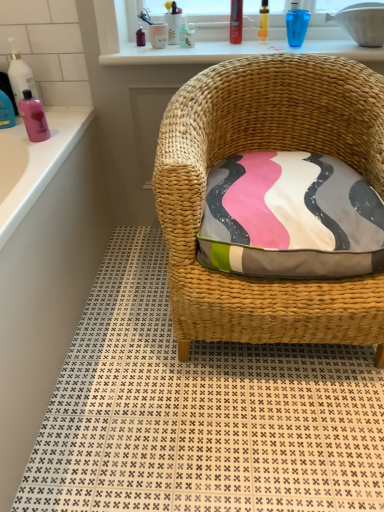
In order to click on woven wicker chair at center in this screenshot , I will do `click(200, 412)`.

The image size is (384, 512). What do you see at coordinates (296, 24) in the screenshot?
I see `translucent plastic cup at upper right, arranged as the first toiletry when viewed from the right` at bounding box center [296, 24].

From the picture: What is the approximate width of translucent yellow bottle at upper center, the second toiletry viewed from the left?

The width of translucent yellow bottle at upper center, the second toiletry viewed from the left, is 1.26 inches.

The image size is (384, 512). What do you see at coordinates (20, 75) in the screenshot? I see `translucent plastic bottle at left, which is the 1th cleaning product from left to right` at bounding box center [20, 75].

What is the approximate height of woven wicker chair at center?

The height of woven wicker chair at center is 31.91 inches.

In order to face shiny plastic tube at upper center, placed as the 3th toiletry when sorted from right to left, should I rotate leftwards or rightwards?

Turn right approximately 5.756 degrees to face it.

You are a GUI agent. You are given a task and a screenshot of the screen. Output one action in this format:
    pyautogui.click(x=<x>, y=<y>)
    Task: Click on the pink glossy bottle at left, the first cleaning product in the right-to-left sequence
    This screenshot has height=512, width=384.
    Given the screenshot: What is the action you would take?
    pyautogui.click(x=33, y=117)

What do you see at coordinates (33, 117) in the screenshot? I see `pink glossy bottle at left, positioned as the second cleaning product in back-to-front order` at bounding box center [33, 117].

The image size is (384, 512). In order to click on woven wicker chair at center in this screenshot , I will do `click(200, 412)`.

Is shiny plastic tube at upper center, the first toiletry viewed from the left, taller than textured fabric pillow at center?

Yes, shiny plastic tube at upper center, the first toiletry viewed from the left, is taller than textured fabric pillow at center.

From the image's perspective, is shiny plastic tube at upper center, the first toiletry viewed from the left, over textured fabric pillow at center?

Indeed, from the image's perspective, shiny plastic tube at upper center, the first toiletry viewed from the left, is shown above textured fabric pillow at center.

Is shiny plastic tube at upper center, placed as the 3th toiletry when sorted from right to left, not inside textured fabric pillow at center?

shiny plastic tube at upper center, placed as the 3th toiletry when sorted from right to left, lies outside textured fabric pillow at center's area.

Is shiny plastic tube at upper center, placed as the 3th toiletry when sorted from right to left, with textured fabric pillow at center?

No, shiny plastic tube at upper center, placed as the 3th toiletry when sorted from right to left, is not touching textured fabric pillow at center.

At what (x,y) coordinates should I click in order to perform the action: click on the 1st toiletry counting from the left side of the textured fabric pillow at center. Please return your answer as a coordinate pair (x, y). Image resolution: width=384 pixels, height=512 pixels. Looking at the image, I should click on (263, 21).

Would you say translucent yellow bottle at upper center, acting as the second toiletry starting from the right, is inside or outside textured fabric pillow at center?

translucent yellow bottle at upper center, acting as the second toiletry starting from the right, is not enclosed by textured fabric pillow at center.

Consider the image. From a real-world perspective, who is located lower, translucent yellow bottle at upper center, acting as the second toiletry starting from the right, or textured fabric pillow at center?

textured fabric pillow at center, from a real-world perspective.

What's the angular difference between translucent yellow bottle at upper center, acting as the second toiletry starting from the right, and textured fabric pillow at center's facing directions?

The angle between the facing direction of translucent yellow bottle at upper center, acting as the second toiletry starting from the right, and the facing direction of textured fabric pillow at center is 0.0304 degrees.

Would you say woven wicker chair at center contains translucent yellow bottle at upper center, the second toiletry viewed from the left?

No, translucent yellow bottle at upper center, the second toiletry viewed from the left, is not inside woven wicker chair at center.

Identify the location of the 1st toiletry to the left of the woven wicker chair at center, starting your count from the anchor. This screenshot has width=384, height=512. (263, 21).

Is woven wicker chair at center further to camera compared to translucent yellow bottle at upper center, the second toiletry viewed from the left?

That is False.

Which is nearer, [358,329] or [265,31]?

Clearly, point [358,329] is closer to the camera than point [265,31].

Is pink plastic bottle at left positioned beyond the bounds of textured fabric pillow at center?

That's correct, pink plastic bottle at left is outside of textured fabric pillow at center.

From the image's perspective, between pink plastic bottle at left and textured fabric pillow at center, which one is located above?

textured fabric pillow at center.

Between point (19, 392) and point (225, 181), which one is positioned in front?

Point (19, 392)

Between pink plastic bottle at left and textured fabric pillow at center, which one has larger size?

Bigger between the two is pink plastic bottle at left.

Considering the relative sizes of shiny plastic tube at upper center, the first toiletry viewed from the left, and pink plastic bottle at left in the image provided, is shiny plastic tube at upper center, the first toiletry viewed from the left, wider than pink plastic bottle at left?

In fact, shiny plastic tube at upper center, the first toiletry viewed from the left, might be narrower than pink plastic bottle at left.

Could shiny plastic tube at upper center, placed as the 3th toiletry when sorted from right to left, be considered to be inside pink plastic bottle at left?

No, shiny plastic tube at upper center, placed as the 3th toiletry when sorted from right to left, is located outside of pink plastic bottle at left.

From a real-world perspective, which object rests below the other?

In real-world perspective, pink plastic bottle at left is lower.

Which is behind, pink plastic bottle at left or shiny plastic tube at upper center, placed as the 3th toiletry when sorted from right to left?

shiny plastic tube at upper center, placed as the 3th toiletry when sorted from right to left, is further from the camera.

Are pink plastic bottle at left and shiny plastic tube at upper center, placed as the 3th toiletry when sorted from right to left, beside each other?

No, pink plastic bottle at left is not next to shiny plastic tube at upper center, placed as the 3th toiletry when sorted from right to left.

Which is closer, (x=358, y=272) or (x=262, y=22)?

Point (x=358, y=272)

Can you confirm if textured fabric pillow at center is taller than translucent yellow bottle at upper center, acting as the second toiletry starting from the right?

Incorrect, the height of textured fabric pillow at center is not larger of that of translucent yellow bottle at upper center, acting as the second toiletry starting from the right.

This screenshot has height=512, width=384. I want to click on toiletry that is the 1st object located above the textured fabric pillow at center (from the image's perspective), so click(263, 21).

In terms of size, does textured fabric pillow at center appear bigger or smaller than translucent yellow bottle at upper center, the second toiletry viewed from the left?

In the image, textured fabric pillow at center appears to be larger than translucent yellow bottle at upper center, the second toiletry viewed from the left.

You are a GUI agent. You are given a task and a screenshot of the screen. Output one action in this format:
    pyautogui.click(x=<x>, y=<y>)
    Task: Click on the pillow below the shiny plastic tube at upper center, the first toiletry viewed from the left (from a real-world perspective)
    The image size is (384, 512).
    Given the screenshot: What is the action you would take?
    pyautogui.click(x=291, y=217)

At what (x,y) coordinates should I click in order to perform the action: click on pillow lying on the right of translucent yellow bottle at upper center, the second toiletry viewed from the left. Please return your answer as a coordinate pair (x, y). This screenshot has width=384, height=512. Looking at the image, I should click on (291, 217).

From the image, which object appears to be nearer to woven wicker chair at center, translucent plastic cup at upper right, arranged as the first toiletry when viewed from the right, or pink plastic bottle at left?

Based on the image, pink plastic bottle at left appears to be nearer to woven wicker chair at center.

Based on their spatial positions, is pink glossy bottle at left, marked as the 2th cleaning product in a top-to-bottom arrangement, or shiny plastic tube at upper center, the first toiletry viewed from the left, closer to woven wicker chair at center?

Based on the image, shiny plastic tube at upper center, the first toiletry viewed from the left, appears to be nearer to woven wicker chair at center.

Based on their spatial positions, is translucent yellow bottle at upper center, acting as the second toiletry starting from the right, or pink glossy bottle at left, the 1th cleaning product ordered from the bottom, further from shiny plastic tube at upper center, the first toiletry viewed from the left?

pink glossy bottle at left, the 1th cleaning product ordered from the bottom, is positioned further to the anchor shiny plastic tube at upper center, the first toiletry viewed from the left.

Which object lies nearer to the anchor point woven wicker chair at center, textured fabric pillow at center or shiny plastic tube at upper center, placed as the 3th toiletry when sorted from right to left?

textured fabric pillow at center.

Which object lies further to the anchor point pink plastic bottle at left, woven wicker chair at center or translucent yellow bottle at upper center, the second toiletry viewed from the left?

translucent yellow bottle at upper center, the second toiletry viewed from the left, is positioned further to the anchor pink plastic bottle at left.

Looking at the image, which one is located closer to translucent plastic cup at upper right, the 3th toiletry in the left-to-right sequence, shiny plastic tube at upper center, placed as the 3th toiletry when sorted from right to left, or translucent yellow bottle at upper center, acting as the second toiletry starting from the right?

translucent yellow bottle at upper center, acting as the second toiletry starting from the right, lies closer to translucent plastic cup at upper right, the 3th toiletry in the left-to-right sequence, than the other object.

Estimate the real-world distances between objects in this image. Which object is further from translucent yellow bottle at upper center, acting as the second toiletry starting from the right, translucent plastic bottle at left, placed as the 1th cleaning product when sorted from back to front, or woven wicker chair at center?

translucent plastic bottle at left, placed as the 1th cleaning product when sorted from back to front.

Which object lies nearer to the anchor point pink glossy bottle at left, the first cleaning product in the right-to-left sequence, translucent yellow bottle at upper center, the second toiletry viewed from the left, or translucent plastic cup at upper right, arranged as the first toiletry when viewed from the right?

translucent yellow bottle at upper center, the second toiletry viewed from the left, lies closer to pink glossy bottle at left, the first cleaning product in the right-to-left sequence, than the other object.

The image size is (384, 512). I want to click on toiletry between translucent plastic bottle at left, placed as the 1th cleaning product when sorted from back to front, and translucent yellow bottle at upper center, the second toiletry viewed from the left, in the horizontal direction, so click(236, 21).

This screenshot has width=384, height=512. Identify the location of toiletry that lies between shiny plastic tube at upper center, the first toiletry viewed from the left, and textured fabric pillow at center from top to bottom. (263, 21).

Identify the location of chair located between translucent plastic bottle at left, acting as the second cleaning product starting from the right, and translucent plastic cup at upper right, arranged as the first toiletry when viewed from the right, in the left-right direction. The height and width of the screenshot is (512, 384). tap(267, 148).

The image size is (384, 512). Identify the location of cleaning product between translucent plastic bottle at left, acting as the second cleaning product starting from the right, and woven wicker chair at center, in the horizontal direction. (33, 117).